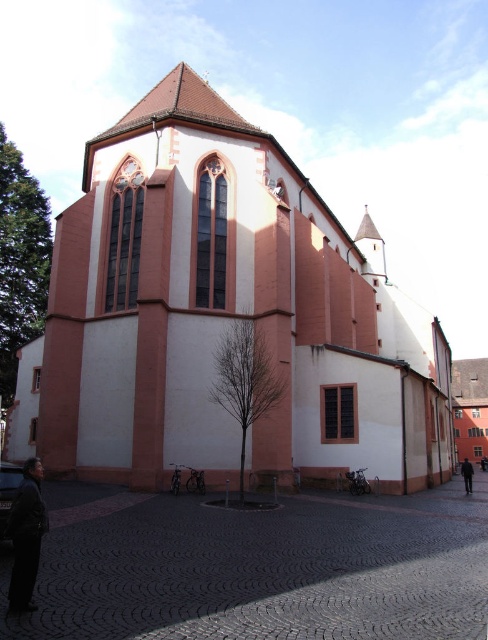
Question: Can you confirm if pink matte church at center is positioned below black leather jacket at lower left?

Choices:
 (A) no
 (B) yes

Answer: (A)

Question: Which object appears closest to the camera in this image?

Choices:
 (A) dark fabric jacket at lower right
 (B) pink matte church at center

Answer: (B)

Question: Where is black leather jacket at lower left located in relation to dark fabric jacket at lower right in the image?

Choices:
 (A) above
 (B) below

Answer: (A)

Question: Considering the real-world distances, which object is closest to the dark fabric jacket at lower right?

Choices:
 (A) black leather jacket at lower left
 (B) pink matte church at center

Answer: (B)

Question: Which object is closer to the camera taking this photo?

Choices:
 (A) pink matte church at center
 (B) black leather jacket at lower left

Answer: (B)

Question: Does pink matte church at center appear on the left side of dark fabric jacket at lower right?

Choices:
 (A) no
 (B) yes

Answer: (B)